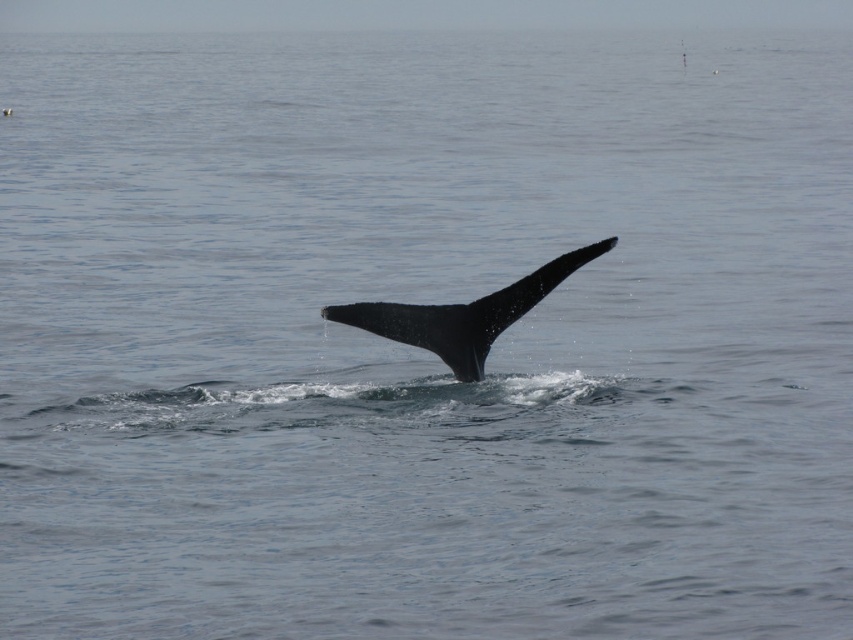
Is point (390, 317) positioned in front of point (474, 346)?

Yes, point (390, 317) is in front of point (474, 346).

Between black matte whale tail at center and black smooth fin at center, which one is positioned lower?

black matte whale tail at center is lower down.

Where is `black matte whale tail at center`? black matte whale tail at center is located at coordinates (463, 314).

Image resolution: width=853 pixels, height=640 pixels. I want to click on black matte whale tail at center, so click(x=463, y=314).